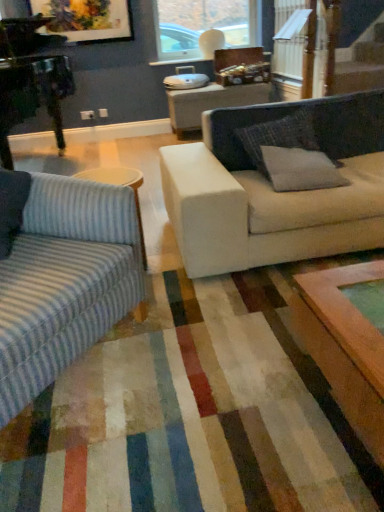
Question: From the image's perspective, is transparent glass window at upper center above or below striped fabric couch at left?

Choices:
 (A) below
 (B) above

Answer: (B)

Question: Considering the positions of transparent glass window at upper center and striped fabric couch at left in the image, is transparent glass window at upper center wider or thinner than striped fabric couch at left?

Choices:
 (A) thin
 (B) wide

Answer: (A)

Question: Which object is positioned farthest from the gray fabric pillow at right, which ranks as the second pillow in back-to-front order?

Choices:
 (A) striped fabric couch at left
 (B) gray fabric pillow at center, which ranks as the 2th pillow in front-to-back order
 (C) matte wooden picture frame at upper left
 (D) transparent glass window at upper center

Answer: (D)

Question: Which of these objects is positioned closest to the gray fabric pillow at right, marked as the first pillow in a front-to-back arrangement?

Choices:
 (A) striped fabric couch at left
 (B) transparent glass window at upper center
 (C) matte wooden picture frame at upper left
 (D) gray fabric pillow at center, which ranks as the 2th pillow in front-to-back order

Answer: (D)